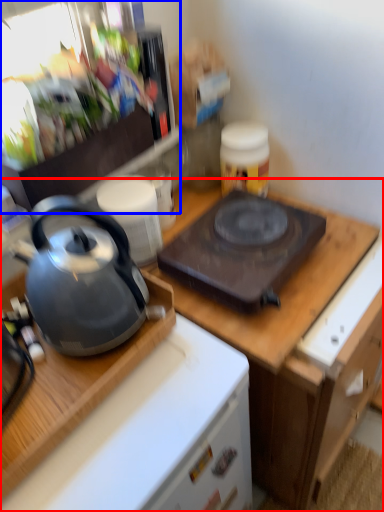
Question: Among these objects, which one is nearest to the camera, cabinetry (highlighted by a red box) or appliance (highlighted by a blue box)?

Choices:
 (A) cabinetry
 (B) appliance

Answer: (B)